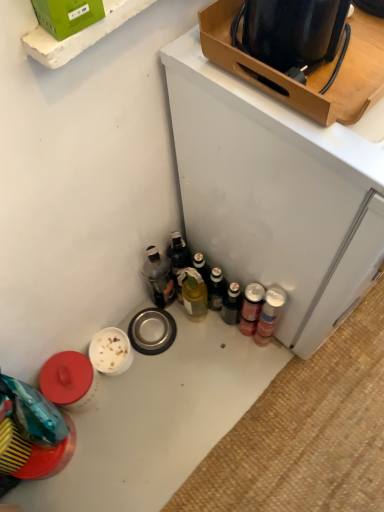
Question: Looking at the image, does translucent glass bottle at center, which is the 3th bottle from left to right, seem bigger or smaller compared to metallic silver can at lower right?

Choices:
 (A) small
 (B) big

Answer: (B)

Question: Is translucent glass bottle at center, the second bottle when ordered from right to left, in front of or behind metallic silver can at lower right in the image?

Choices:
 (A) front
 (B) behind

Answer: (B)

Question: Which is nearer to the translucent plastic bottle at center, placed as the 2th bottle when sorted from left to right?

Choices:
 (A) translucent glass bottle at center, the 4th bottle positioned from the right
 (B) wooden tray at upper right, the first box from the back
 (C) metallic silver can at lower right, the 4th bottle in the left-to-right sequence
 (D) green cardboard box at upper left, the first box positioned from the left
 (E) white glossy table at lower left

Answer: (A)

Question: Which is nearer to the translucent plastic bottle at center, the third bottle viewed from the right?

Choices:
 (A) metallic silver can at lower right, the 4th bottle in the left-to-right sequence
 (B) white glossy table at lower left
 (C) wooden tray at upper right, which appears as the 1th box when viewed from the right
 (D) metallic silver can at lower right
 (E) green cardboard box at upper left, placed as the 2th box when sorted from back to front

Answer: (D)